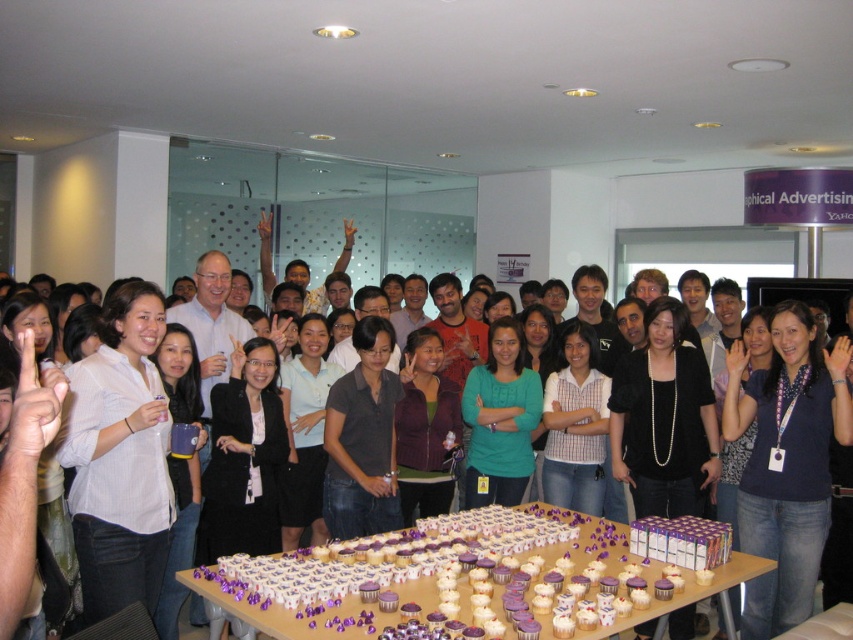
Question: Among these points, which one is nearest to the camera?

Choices:
 (A) (451, 589)
 (B) (761, 540)

Answer: (A)

Question: Is white cardboard table at center thinner than blue fabric shirt at center?

Choices:
 (A) yes
 (B) no

Answer: (B)

Question: Which object is closer to the camera taking this photo?

Choices:
 (A) white cardboard table at center
 (B) blue fabric shirt at center

Answer: (A)

Question: Where is white cardboard table at center located in relation to blue fabric shirt at center in the image?

Choices:
 (A) right
 (B) left

Answer: (B)

Question: Does white cardboard table at center have a greater width compared to blue fabric shirt at center?

Choices:
 (A) no
 (B) yes

Answer: (B)